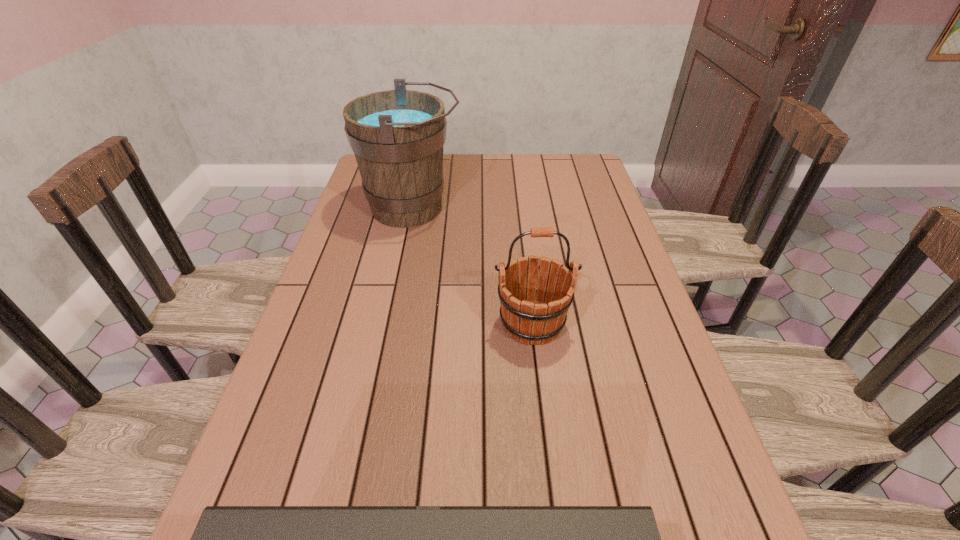
I want to click on free spot at the left edge of the desktop, so click(348, 352).

Locate an element on the screen. The image size is (960, 540). vacant area at the right edge is located at coordinates (598, 246).

The height and width of the screenshot is (540, 960). Identify the location of free space at the far right corner. (563, 185).

Locate an element on the screen. The height and width of the screenshot is (540, 960). unoccupied area between the tallest object and the right wine bucket is located at coordinates (472, 266).

Locate an element on the screen. empty location between the taller wine bucket and the right wine bucket is located at coordinates (472, 266).

Identify the location of vacant area between the farther wine bucket and the second nearest object. (472, 266).

Image resolution: width=960 pixels, height=540 pixels. Identify the location of free space between the farthest object and the right wine bucket. (472, 266).

Locate an element on the screen. vacant space that is in between the farther wine bucket and the second farthest object is located at coordinates (472, 266).

The width and height of the screenshot is (960, 540). I want to click on free point between the tallest object and the nearer wine bucket, so click(472, 266).

You are a GUI agent. You are given a task and a screenshot of the screen. Output one action in this format:
    pyautogui.click(x=<x>, y=<y>)
    Task: Click on the object that is the closest to the tallest object
    The width and height of the screenshot is (960, 540).
    Given the screenshot: What is the action you would take?
    pyautogui.click(x=529, y=321)